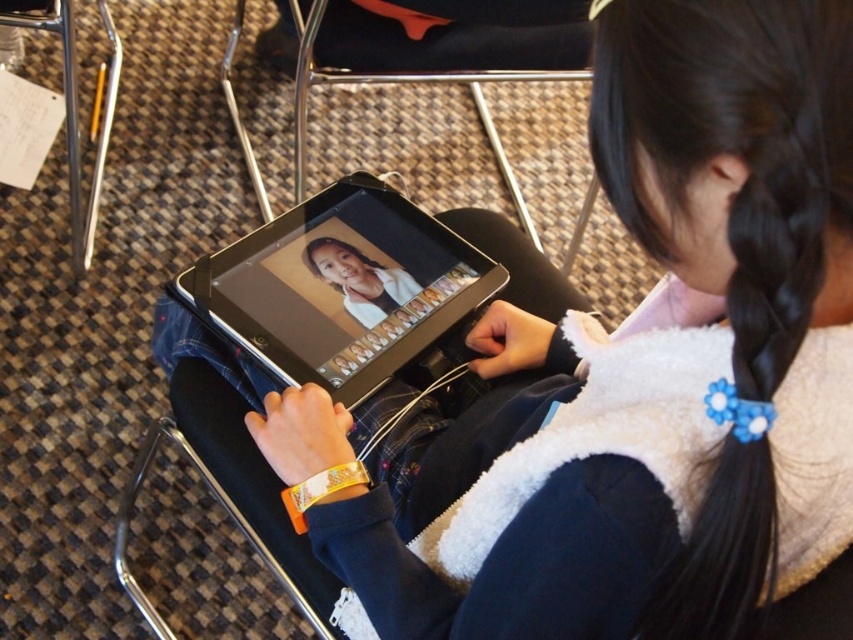
Question: Which point is farther from the camera taking this photo?

Choices:
 (A) (682, 515)
 (B) (231, 422)

Answer: (B)

Question: Is white fleece vest at center to the left of black glossy tablet at center from the viewer's perspective?

Choices:
 (A) yes
 (B) no

Answer: (B)

Question: Can you confirm if black glossy tablet at center is thinner than black plastic chair at center?

Choices:
 (A) yes
 (B) no

Answer: (A)

Question: Can you confirm if black glossy tablet at center is wider than black plastic chair at center?

Choices:
 (A) no
 (B) yes

Answer: (A)

Question: Which point is closer to the camera?

Choices:
 (A) black plastic chair at center
 (B) white fleece vest at center
 (C) black glossy tablet at center

Answer: (B)

Question: Which object is closer to the camera taking this photo?

Choices:
 (A) black plastic chair at center
 (B) black glossy tablet at center

Answer: (A)